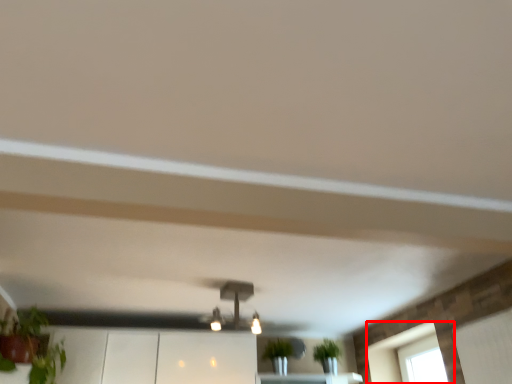
Question: In this image, where is window (annotated by the red box) located relative to light fixture?

Choices:
 (A) right
 (B) left

Answer: (A)